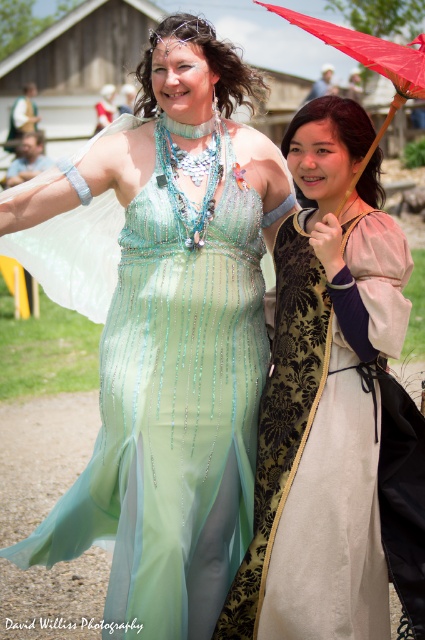
You are a photographer at a fashion show. You need to position the velvet gold dress at center and the red fabric umbrella at upper right in your shot. Based on their sizes, which object should you ensure is fully visible in the frame first?

The velvet gold dress at center has a lesser height compared to the red fabric umbrella at upper right, so you should ensure the velvet gold dress at center is fully visible first as it is smaller and might be positioned lower in the frame.

You are taking a photo of two people at a festival. You notice two points marked in the image. One is at point [176,506] and the other at point [385,65]. If you want to focus on the point closer to you, which coordinate should you adjust your camera to?

Point [176,506] is closer to the camera than point [385,65], so you should adjust your camera to focus on point [176,506].

You are standing at the point marked as point (183, 490) and want to take a photo of the two people in the scene. The camera you are using has a maximum range of 20 feet. Will you be able to capture both individuals in the photo without moving closer?

The distance between you and point (183, 490) is 19.29 feet, which is within the camera maximum range of 20 feet. Therefore, you can capture both individuals in the photo without moving closer.